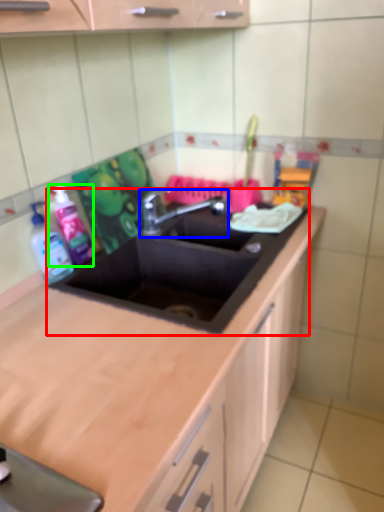
Question: Based on their relative distances, which object is nearer to sink (highlighted by a red box)? Choose from tap (highlighted by a blue box) and cleaning product (highlighted by a green box).

Choices:
 (A) tap
 (B) cleaning product

Answer: (A)